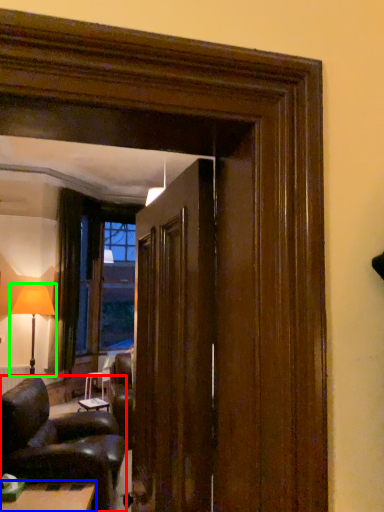
Question: Which is farther away from chair (highlighted by a red box)? table (highlighted by a blue box) or table lamp (highlighted by a green box)?

Choices:
 (A) table
 (B) table lamp

Answer: (B)